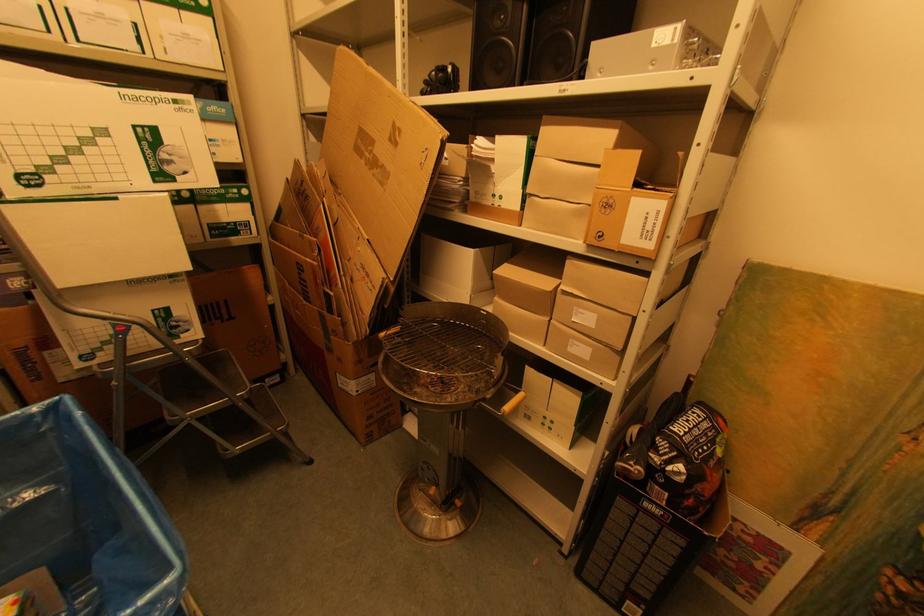
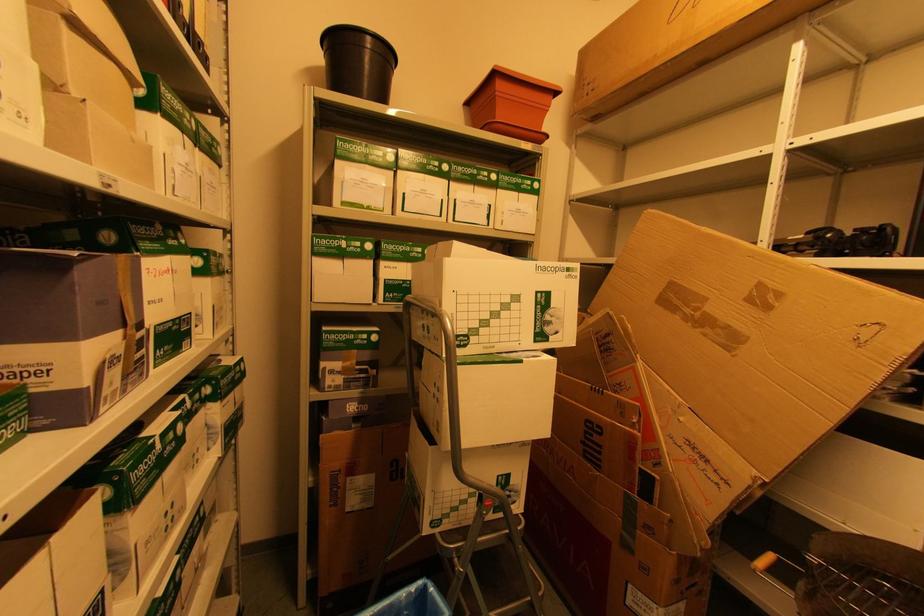
The images are taken continuously from a first-person perspective. In which direction is your viewpoint rotating?

The camera rotated toward left-up.